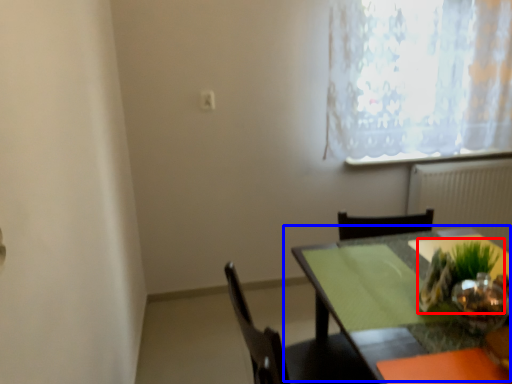
Question: Which object is further to the camera taking this photo, houseplant (highlighted by a red box) or table (highlighted by a blue box)?

Choices:
 (A) houseplant
 (B) table

Answer: (A)